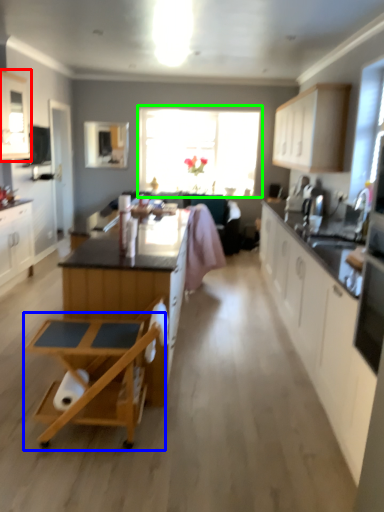
Question: Based on their relative distances, which object is nearer to cabinetry (highlighted by a red box)? Choose from table (highlighted by a blue box) and window (highlighted by a green box).

Choices:
 (A) table
 (B) window

Answer: (B)